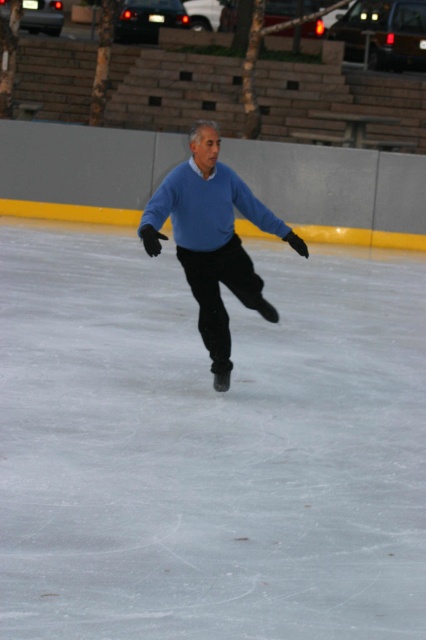
Question: Is white smooth ice at center smaller than matte blue sweater at center?

Choices:
 (A) no
 (B) yes

Answer: (A)

Question: Which of the following is the closest to the observer?

Choices:
 (A) white smooth ice at center
 (B) matte blue sweater at center

Answer: (A)

Question: Among these points, which one is nearest to the camera?

Choices:
 (A) (49, 336)
 (B) (150, 234)

Answer: (B)

Question: Is white smooth ice at center above matte blue sweater at center?

Choices:
 (A) no
 (B) yes

Answer: (A)

Question: Considering the relative positions of white smooth ice at center and matte blue sweater at center in the image provided, where is white smooth ice at center located with respect to matte blue sweater at center?

Choices:
 (A) left
 (B) right

Answer: (A)